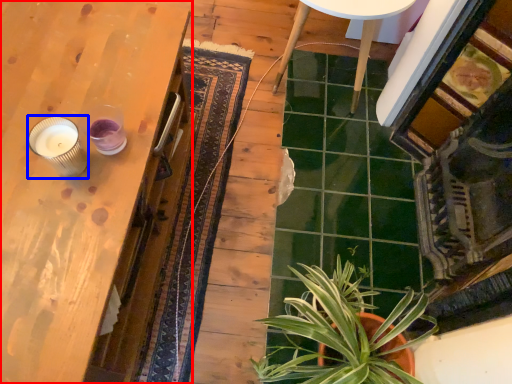
Question: Which point is closer to the camera, table (highlighted by a red box) or candle holder (highlighted by a blue box)?

Choices:
 (A) table
 (B) candle holder

Answer: (A)